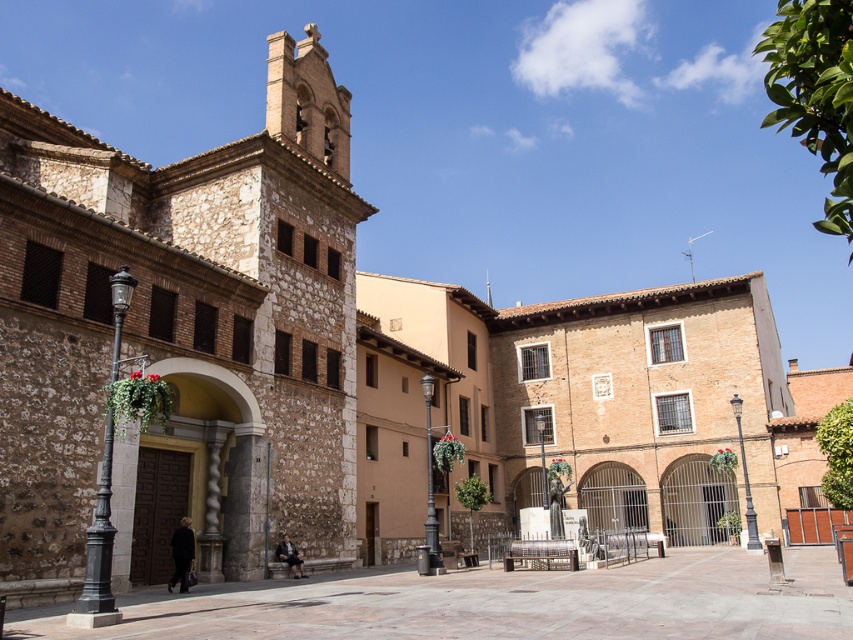
Question: Which object is farther from the camera taking this photo?

Choices:
 (A) brown stone church at left
 (B) smooth stone pavement at center

Answer: (A)

Question: Can you confirm if brown stone church at left is wider than smooth stone pavement at center?

Choices:
 (A) yes
 (B) no

Answer: (B)

Question: In this image, where is brown stone church at left located relative to smooth stone pavement at center?

Choices:
 (A) right
 (B) left

Answer: (B)

Question: Is brown stone church at left positioned before smooth stone pavement at center?

Choices:
 (A) no
 (B) yes

Answer: (A)